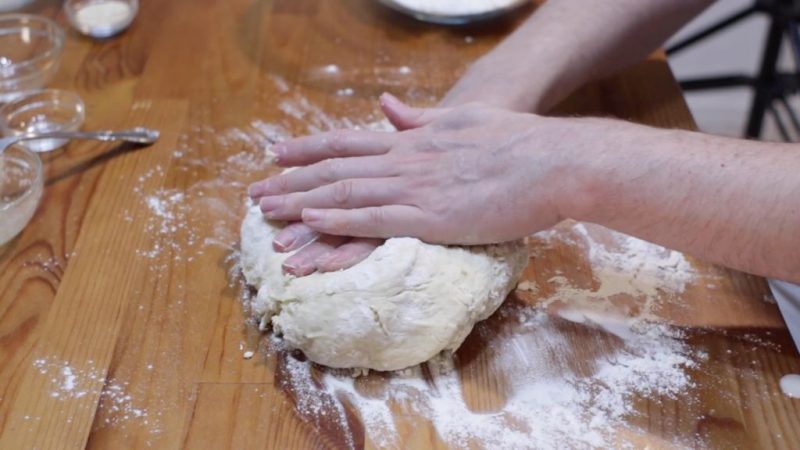
Where is `four glass bowls`? The width and height of the screenshot is (800, 450). four glass bowls is located at coordinates (94, 18), (22, 56), (37, 105), (22, 178).